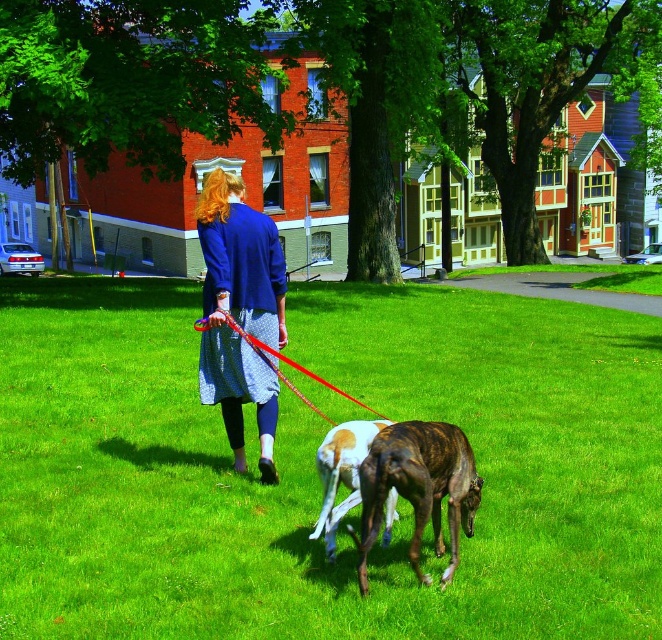
How much distance is there between blue cotton jacket at center and brindle fur dog at center?

blue cotton jacket at center and brindle fur dog at center are 2.11 meters apart.

Which is above, blue cotton jacket at center or brindle fur dog at center?

Positioned higher is blue cotton jacket at center.

Locate an element on the screen. This screenshot has height=640, width=662. blue cotton jacket at center is located at coordinates (240, 312).

Between green grass at center and brown and white fur at center, which one appears on the right side from the viewer's perspective?

Positioned to the right is brown and white fur at center.

Between point (647, 545) and point (385, 420), which one is positioned in front?

Positioned in front is point (385, 420).

What do you see at coordinates (314, 467) in the screenshot? This screenshot has height=640, width=662. I see `green grass at center` at bounding box center [314, 467].

The image size is (662, 640). What are the coordinates of `green grass at center` in the screenshot? It's located at (314, 467).

Which of these two, blue cotton jacket at center or rubber red leash at center, stands shorter?

rubber red leash at center is shorter.

Which is behind, point (232, 307) or point (318, 381)?

Point (318, 381)

Locate an element on the screen. Image resolution: width=662 pixels, height=640 pixels. blue cotton jacket at center is located at coordinates (240, 312).